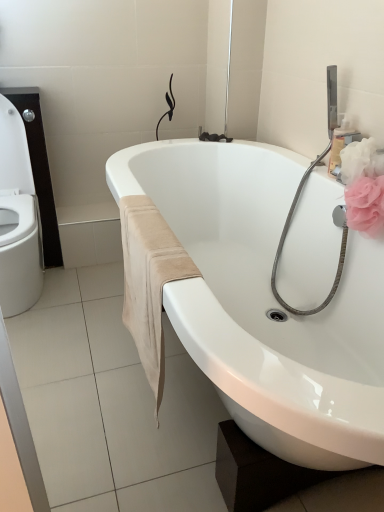
Question: Considering the positions of black rubber faucet at upper center and beige suede towel at lower center in the image, is black rubber faucet at upper center taller or shorter than beige suede towel at lower center?

Choices:
 (A) short
 (B) tall

Answer: (A)

Question: In terms of size, does black rubber faucet at upper center appear bigger or smaller than beige suede towel at lower center?

Choices:
 (A) big
 (B) small

Answer: (B)

Question: Which of these objects is positioned closest to the beige suede towel at lower center?

Choices:
 (A) pink fabric flower at upper right
 (B) black rubber faucet at upper center
 (C) white glossy bathtub at center

Answer: (C)

Question: Estimate the real-world distances between objects in this image. Which object is closer to the beige suede towel at lower center?

Choices:
 (A) white glossy bathtub at center
 (B) black rubber faucet at upper center
 (C) pink fabric flower at upper right

Answer: (A)